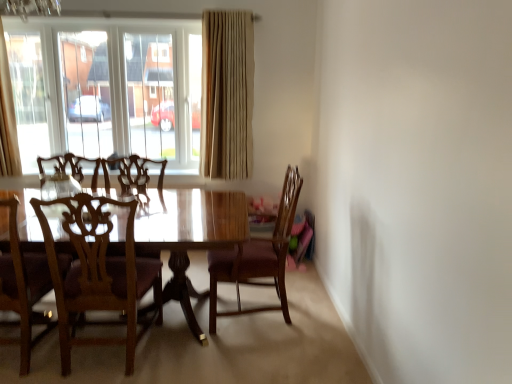
Question: Can beige fabric curtain at upper left, the first curtain positioned from the left, be found inside transparent glass window at upper left?

Choices:
 (A) yes
 (B) no

Answer: (B)

Question: Does transparent glass window at upper left lie in front of beige fabric curtain at upper left, the first curtain positioned from the left?

Choices:
 (A) yes
 (B) no

Answer: (B)

Question: From the image's perspective, would you say transparent glass window at upper left is positioned over beige fabric curtain at upper left, the first curtain positioned from the left?

Choices:
 (A) no
 (B) yes

Answer: (B)

Question: Is transparent glass window at upper left facing away from beige fabric curtain at upper left, the first curtain positioned from the left?

Choices:
 (A) yes
 (B) no

Answer: (B)

Question: From a real-world perspective, is transparent glass window at upper left physically above beige fabric curtain at upper left, the first curtain positioned from the left?

Choices:
 (A) no
 (B) yes

Answer: (A)

Question: Does transparent glass window at upper left turn towards beige fabric curtain at upper left, the first curtain positioned from the left?

Choices:
 (A) yes
 (B) no

Answer: (A)

Question: From the image's perspective, is beige fabric curtain at upper center, arranged as the first curtain when viewed from the right, below transparent glass window at upper left?

Choices:
 (A) no
 (B) yes

Answer: (B)

Question: Does beige fabric curtain at upper center, positioned as the 2th curtain in left-to-right order, come in front of transparent glass window at upper left?

Choices:
 (A) no
 (B) yes

Answer: (B)

Question: Does beige fabric curtain at upper center, arranged as the first curtain when viewed from the right, have a lesser width compared to transparent glass window at upper left?

Choices:
 (A) no
 (B) yes

Answer: (B)

Question: Is beige fabric curtain at upper center, arranged as the first curtain when viewed from the right, shorter than transparent glass window at upper left?

Choices:
 (A) no
 (B) yes

Answer: (A)

Question: Considering the relative sizes of beige fabric curtain at upper center, positioned as the 2th curtain in left-to-right order, and transparent glass window at upper left in the image provided, is beige fabric curtain at upper center, positioned as the 2th curtain in left-to-right order, taller than transparent glass window at upper left?

Choices:
 (A) no
 (B) yes

Answer: (B)

Question: Is transparent glass window at upper left surrounded by beige fabric curtain at upper center, arranged as the first curtain when viewed from the right?

Choices:
 (A) no
 (B) yes

Answer: (A)

Question: Can you confirm if wooden chair at left, arranged as the 3th chair when viewed from the right, is positioned to the right of wooden chair at center, which appears as the 1th chair when viewed from the right?

Choices:
 (A) yes
 (B) no

Answer: (B)